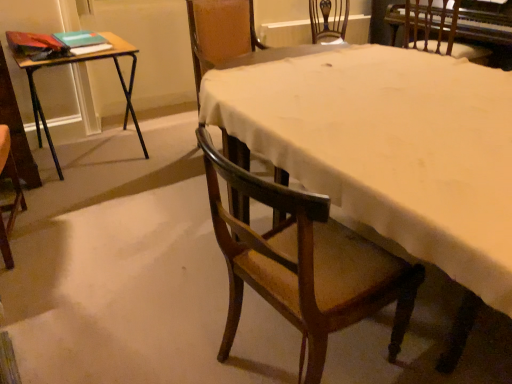
Question: Does wooden folding table at left appear on the right side of white cloth at center?

Choices:
 (A) yes
 (B) no

Answer: (B)

Question: Is wooden folding table at left positioned far away from white cloth at center?

Choices:
 (A) yes
 (B) no

Answer: (A)

Question: Considering the relative positions of wooden folding table at left and white cloth at center in the image provided, is wooden folding table at left to the left of white cloth at center from the viewer's perspective?

Choices:
 (A) yes
 (B) no

Answer: (A)

Question: Considering the relative sizes of wooden folding table at left and white cloth at center in the image provided, is wooden folding table at left wider than white cloth at center?

Choices:
 (A) yes
 (B) no

Answer: (B)

Question: Is wooden folding table at left located outside white cloth at center?

Choices:
 (A) yes
 (B) no

Answer: (A)

Question: Is wooden chair at center, acting as the 1th chair starting from the left, in front of or behind white cloth at center in the image?

Choices:
 (A) front
 (B) behind

Answer: (B)

Question: Is wooden chair at center, the 2th chair when ordered from back to front, taller or shorter than white cloth at center?

Choices:
 (A) short
 (B) tall

Answer: (B)

Question: Would you say wooden chair at center, the 2th chair when ordered from back to front, is to the left or to the right of white cloth at center in the picture?

Choices:
 (A) right
 (B) left

Answer: (B)

Question: Is wooden chair at center, acting as the 1th chair starting from the left, situated inside white cloth at center or outside?

Choices:
 (A) inside
 (B) outside

Answer: (B)

Question: Based on their positions, is white cloth at center located to the left or right of wooden chair at lower right, marked as the 2th chair in a left-to-right arrangement?

Choices:
 (A) right
 (B) left

Answer: (A)

Question: Looking at the image, does white cloth at center seem bigger or smaller compared to wooden chair at lower right, which appears as the first chair when viewed from the front?

Choices:
 (A) big
 (B) small

Answer: (A)

Question: Does point (391, 115) appear closer or farther from the camera than point (321, 218)?

Choices:
 (A) farther
 (B) closer

Answer: (A)

Question: Is white cloth at center in front of or behind wooden chair at lower right, marked as the 2th chair in a left-to-right arrangement, in the image?

Choices:
 (A) front
 (B) behind

Answer: (A)

Question: Is white cloth at center inside the boundaries of green matte book at upper left, which ranks as the 2th book in top-to-bottom order, or outside?

Choices:
 (A) inside
 (B) outside

Answer: (B)

Question: Does point (414, 119) appear closer or farther from the camera than point (87, 51)?

Choices:
 (A) closer
 (B) farther

Answer: (A)